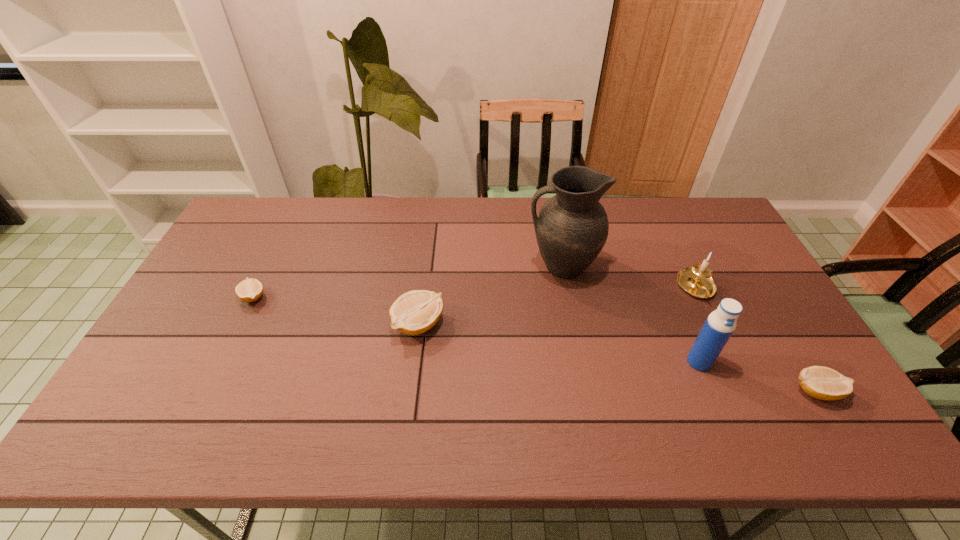
Image resolution: width=960 pixels, height=540 pixels. Find the location of `the second tallest object`. the second tallest object is located at coordinates (721, 323).

At what (x,y) coordinates should I click in order to perform the action: click on water bottle. Please return your answer as a coordinate pair (x, y). Image resolution: width=960 pixels, height=540 pixels. Looking at the image, I should click on (721, 323).

This screenshot has width=960, height=540. I want to click on blank space located on the right of the leftmost object, so click(x=331, y=297).

Identify the location of free space located 0.130m on the left of the second lemon from right to left. (347, 325).

You are a GUI agent. You are given a task and a screenshot of the screen. Output one action in this format:
    pyautogui.click(x=<x>, y=<y>)
    Task: Click on the vacant space located on the left of the rightmost lemon
    The image size is (960, 540).
    Given the screenshot: What is the action you would take?
    pyautogui.click(x=717, y=391)

Where is `free region located on the side of the tallest object with the handle`? The height and width of the screenshot is (540, 960). free region located on the side of the tallest object with the handle is located at coordinates (491, 266).

Image resolution: width=960 pixels, height=540 pixels. Find the location of `free space located 0.130m on the side of the tallest object with the handle`. free space located 0.130m on the side of the tallest object with the handle is located at coordinates (484, 266).

Where is `vacant area located 0.050m on the side of the tallest object with the handle`? The height and width of the screenshot is (540, 960). vacant area located 0.050m on the side of the tallest object with the handle is located at coordinates (510, 266).

Locate an element on the screen. free spot located on the handle side of the third tallest object is located at coordinates (712, 320).

Where is `vacant space located 0.120m on the right of the water bottle`? vacant space located 0.120m on the right of the water bottle is located at coordinates (757, 362).